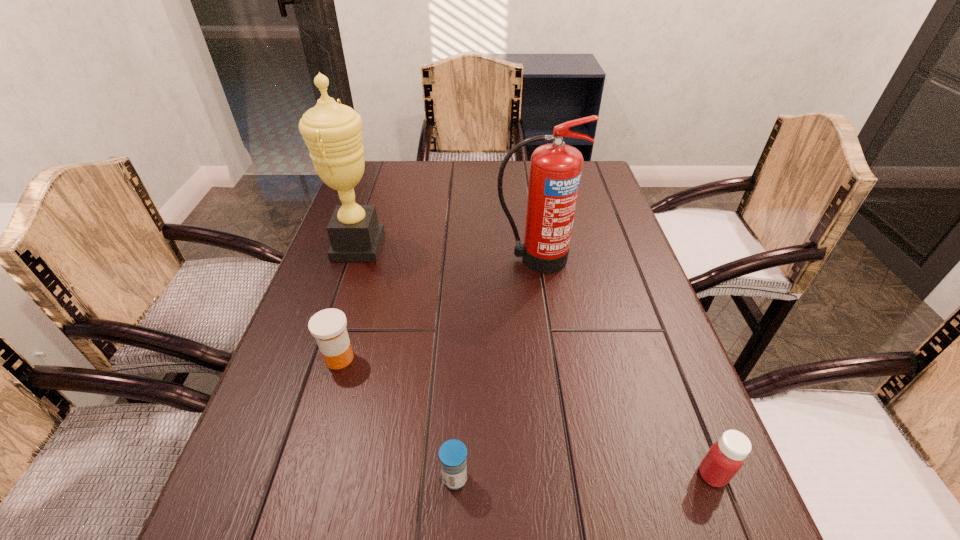
The width and height of the screenshot is (960, 540). What are the coordinates of `free spot that satisfies the following two spatial constraints: 1. on the label of the rightmost medicine; 2. on the right side of the leftmost medicine` in the screenshot? It's located at (304, 475).

Locate an element on the screen. The height and width of the screenshot is (540, 960). blank area in the image that satisfies the following two spatial constraints: 1. on the label of the shortest object; 2. on the left side of the third nearest object is located at coordinates (303, 478).